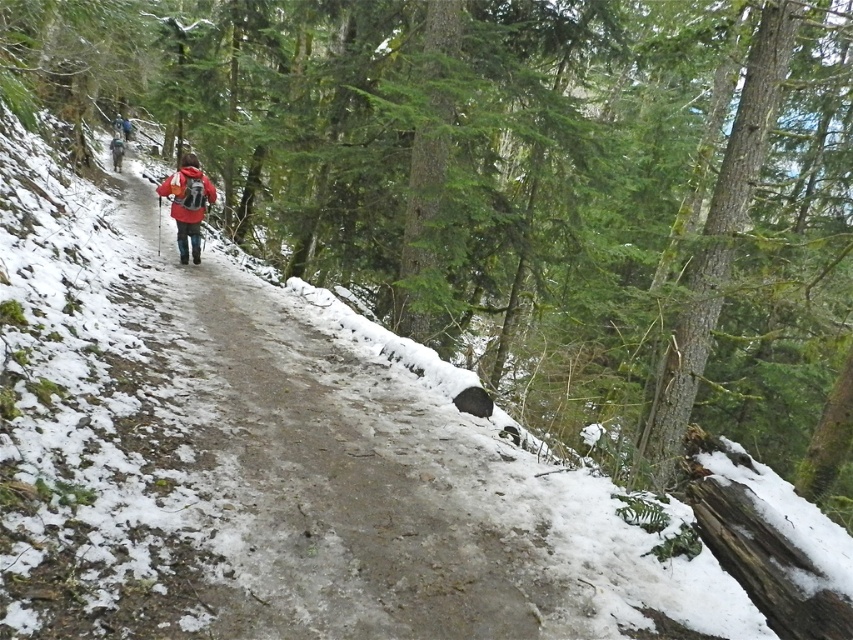
Is matte red jacket at center shorter than red jacket at center?

In fact, matte red jacket at center may be taller than red jacket at center.

Between matte red jacket at center and red jacket at center, which one appears on the right side from the viewer's perspective?

matte red jacket at center is more to the right.

Identify the location of matte red jacket at center. (189, 204).

I want to click on matte red jacket at center, so click(189, 204).